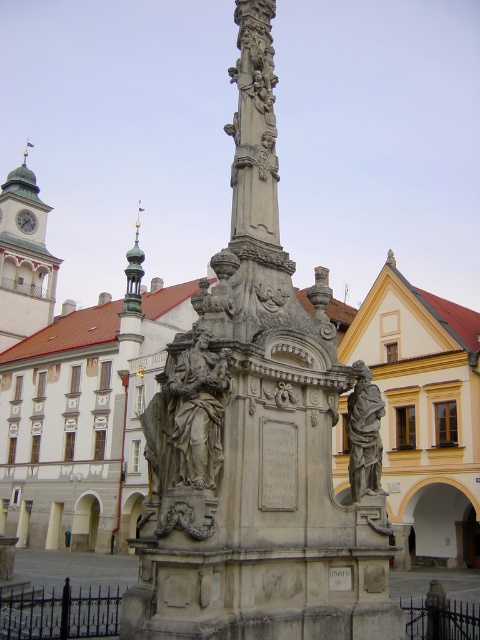
Question: Which point is farther from the camera taking this photo?

Choices:
 (A) (345, 570)
 (B) (20, 225)

Answer: (B)

Question: Can you confirm if gray stone monument at center is thinner than white stone plaque at center?

Choices:
 (A) yes
 (B) no

Answer: (B)

Question: Is gray stone monument at center positioned at the back of stone plaque at center?

Choices:
 (A) yes
 (B) no

Answer: (B)

Question: Does stone plaque at center have a smaller size compared to white marble clock at upper center?

Choices:
 (A) no
 (B) yes

Answer: (B)

Question: Estimate the real-world distances between objects in this image. Which object is closer to the white stone plaque at center?

Choices:
 (A) gray stone monument at center
 (B) polished stone statue at center
 (C) stone plaque at center
 (D) green stone clock tower at upper left

Answer: (B)

Question: Which of these objects is positioned farthest from the green stone clock tower at upper left?

Choices:
 (A) polished stone statue at center
 (B) gray stone monument at center
 (C) white stone plaque at center

Answer: (A)